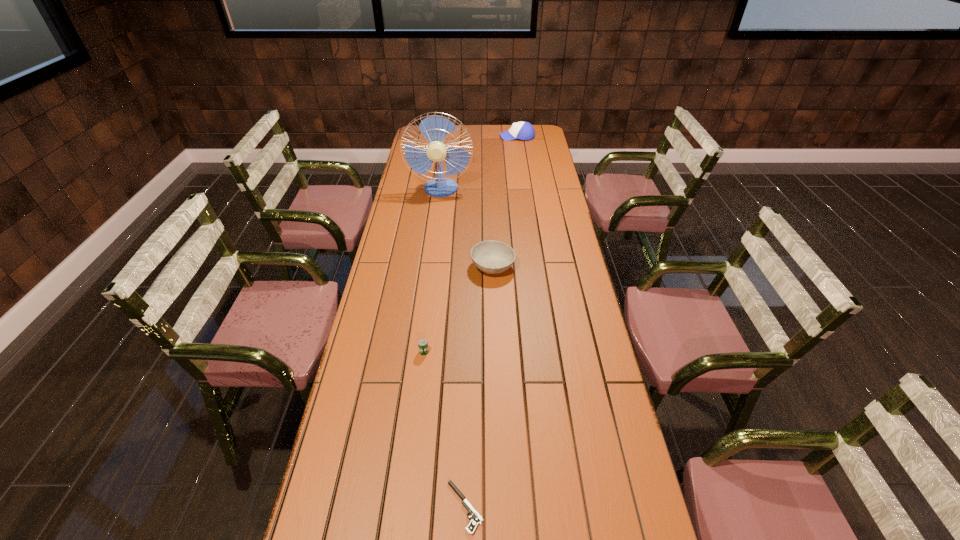
Find the location of `free space between the farthest object and the pistol`. free space between the farthest object and the pistol is located at coordinates (491, 322).

I want to click on free spot between the shortest object and the baseball cap, so click(x=491, y=322).

At what (x,y) coordinates should I click in order to perform the action: click on free space between the shortest object and the third nearest object. Please return your answer as a coordinate pair (x, y). The image size is (960, 540). Looking at the image, I should click on (479, 387).

Identify the location of vacant area that lies between the pistol and the fourth nearest object. (453, 348).

Find the location of a particular element. The image size is (960, 540). vacant space that is in between the tallest object and the shortest object is located at coordinates (453, 348).

The height and width of the screenshot is (540, 960). In order to click on free space between the nearest object and the fourth tallest object in this screenshot , I will do `click(444, 429)`.

You are a GUI agent. You are given a task and a screenshot of the screen. Output one action in this format:
    pyautogui.click(x=<x>, y=<y>)
    Task: Click on the vacant point located between the tallest object and the fourth shortest object
    The height and width of the screenshot is (540, 960).
    Given the screenshot: What is the action you would take?
    pyautogui.click(x=479, y=163)

Identify which object is the fourth closest to the nearest object. Please provide its 2D coordinates. Your answer should be formatted as a tuple, i.e. [(x, y)], where the tuple contains the x and y coordinates of a point satisfying the conditions above.

[(522, 130)]

Find the location of a particular element. Image resolution: width=960 pixels, height=540 pixels. object that ranks as the second closest to the fourth shortest object is located at coordinates (492, 257).

Locate an element on the screen. Image resolution: width=960 pixels, height=540 pixels. free space that satisfies the following two spatial constraints: 1. at the front of the second shortest object where the blades are visible; 2. on the right side of the fan is located at coordinates (420, 352).